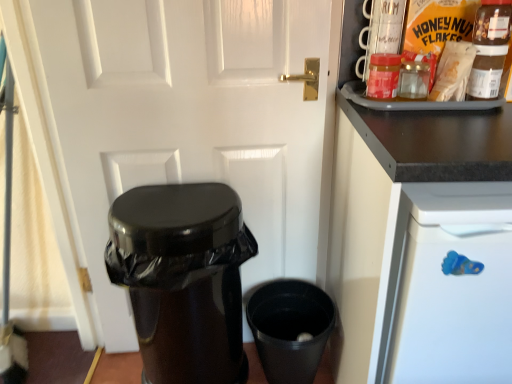
Question: From the image's perspective, is matte brown paper bag at upper right, the first food in the front-to-back sequence, above or below black glossy trash can at lower left?

Choices:
 (A) below
 (B) above

Answer: (B)

Question: Does point (474, 54) appear closer or farther from the camera than point (165, 203)?

Choices:
 (A) closer
 (B) farther

Answer: (A)

Question: Which object is the farthest from the white glossy door at center?

Choices:
 (A) black glossy trash can at lower left
 (B) matte brown paper bag at upper right, the first food in the front-to-back sequence
 (C) black plastic cup at lower right
 (D) matte plastic jar at upper right
 (E) black matte cabinet at upper right

Answer: (B)

Question: Which of these objects is positioned closest to the matte plastic jar at upper right?

Choices:
 (A) black matte cabinet at upper right
 (B) black glossy trash can at lower left
 (C) matte brown paper bag at upper right, acting as the 2th food starting from the back
 (D) white glossy door at center
 (E) matte plastic honey nut flakes at upper right, the 1th food from the back

Answer: (E)